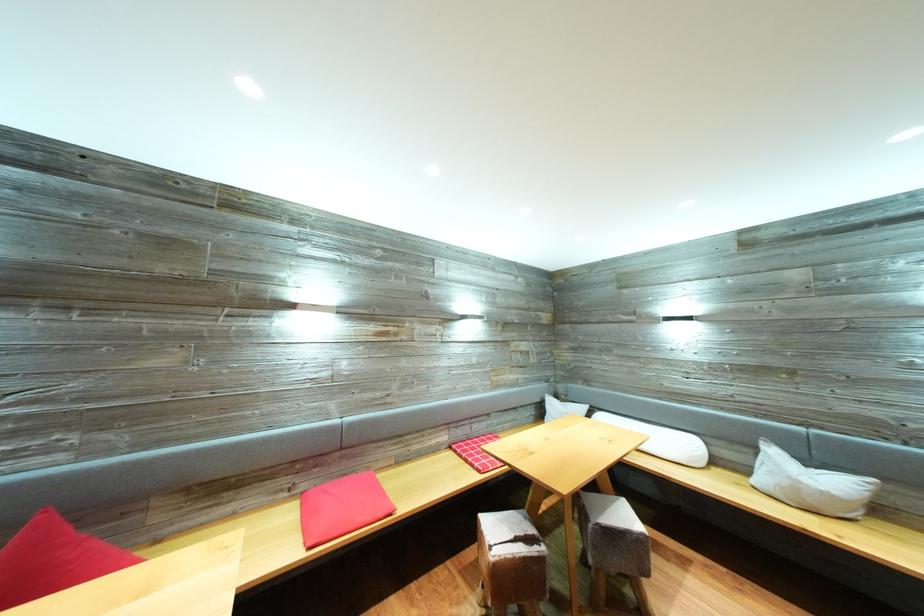
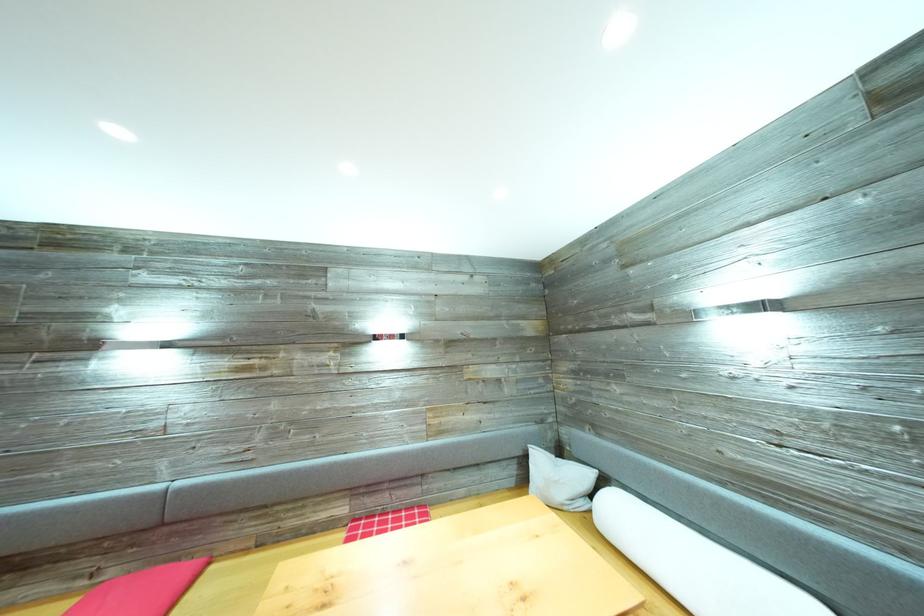
The point at (310, 493) is marked in the first image. Where is the corresponding point in the second image?

(117, 578)